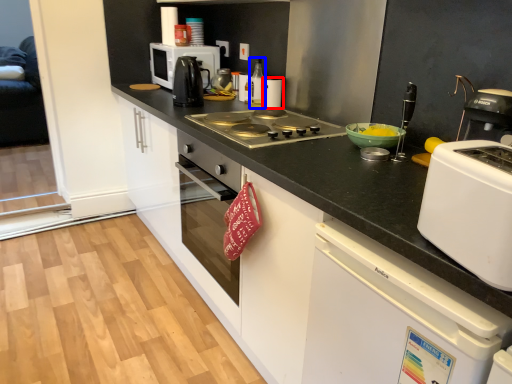
Question: Among these objects, which one is nearest to the camera, kitchen appliance (highlighted by a red box) or kitchen appliance (highlighted by a blue box)?

Choices:
 (A) kitchen appliance
 (B) kitchen appliance

Answer: (B)